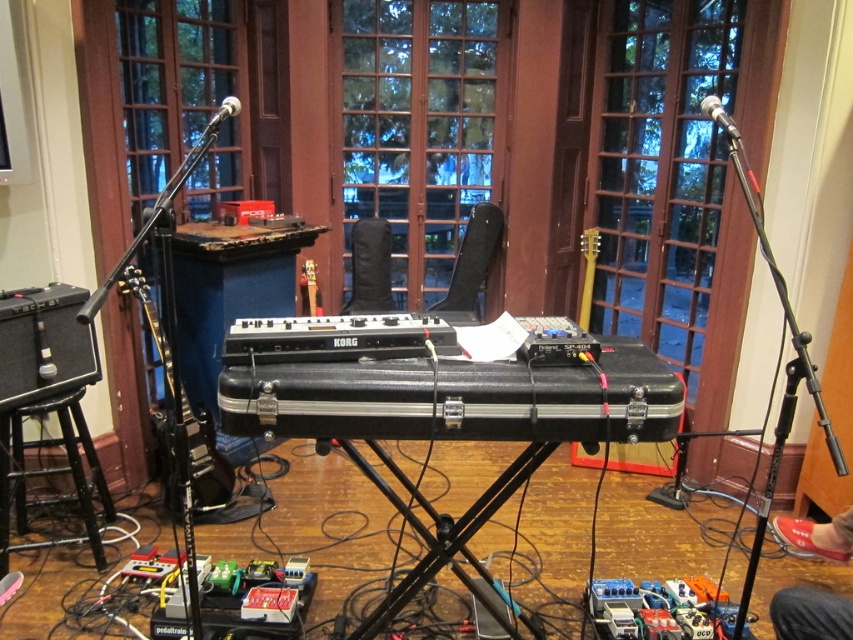
Is point (88, 541) closer to camera compared to point (320, 312)?

Yes, it is.

Which is in front, point (38, 500) or point (311, 316)?

Point (38, 500) is more forward.

The height and width of the screenshot is (640, 853). I want to click on black wood stool at lower left, so click(51, 474).

Does yellow matte guitar at center appear on the right side of matte brown guitar at center?

Yes, yellow matte guitar at center is to the right of matte brown guitar at center.

Which is behind, point (596, 250) or point (314, 273)?

Positioned behind is point (314, 273).

This screenshot has width=853, height=640. In order to click on yellow matte guitar at center in this screenshot , I will do [589, 273].

Can you confirm if black glossy electric guitar at left is shorter than matte brown guitar at center?

No.

Which is in front, point (164, 316) or point (315, 292)?

Point (164, 316)

This screenshot has width=853, height=640. Find the location of `black glossy electric guitar at left`. black glossy electric guitar at left is located at coordinates (184, 410).